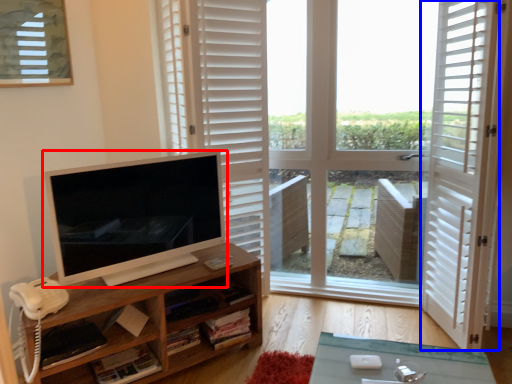
Question: Which object appears closest to the camera in this image, computer monitor (highlighted by a red box) or screen door (highlighted by a blue box)?

Choices:
 (A) computer monitor
 (B) screen door

Answer: (B)